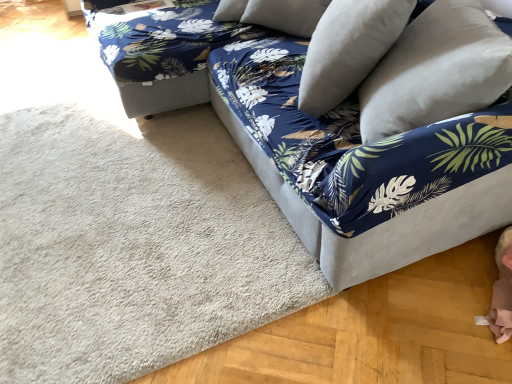
Measure the distance between velvet blue couch at center and camera.

The distance of velvet blue couch at center from camera is 1.08 meters.

What do you see at coordinates (436, 71) in the screenshot?
I see `velvety white pillow at upper right, which ranks as the second pillow in left-to-right order` at bounding box center [436, 71].

You are a GUI agent. You are given a task and a screenshot of the screen. Output one action in this format:
    pyautogui.click(x=<x>, y=<y>)
    Task: Click on the beige carpet at lower left
    This screenshot has height=384, width=512.
    Given the screenshot: What is the action you would take?
    pyautogui.click(x=134, y=246)

Could you measure the distance between beige carpet at lower left and velvety white pillow at upper right, which ranks as the second pillow in left-to-right order?

beige carpet at lower left is 36.79 inches away from velvety white pillow at upper right, which ranks as the second pillow in left-to-right order.

From a real-world perspective, between beige carpet at lower left and velvety white pillow at upper right, the first pillow viewed from the right, who is vertically higher?

In real-world perspective, velvety white pillow at upper right, the first pillow viewed from the right, is above.

Based on their sizes in the image, would you say beige carpet at lower left is bigger or smaller than velvety white pillow at upper right, which ranks as the second pillow in left-to-right order?

beige carpet at lower left is smaller than velvety white pillow at upper right, which ranks as the second pillow in left-to-right order.

Which of these two, beige carpet at lower left or velvety white pillow at upper right, the first pillow viewed from the right, stands shorter?

beige carpet at lower left is shorter.

Starting from the blue floral fabric bean bag at upper right, which pillow is the 2nd one in front? Please provide its 2D coordinates.

[(436, 71)]

Does point (480, 76) appear closer or farther from the camera than point (187, 66)?

Point (480, 76) is closer to the camera than point (187, 66).

How far apart are velvety white pillow at upper right, which ranks as the second pillow in left-to-right order, and blue floral fabric bean bag at upper right?

A distance of 4.11 feet exists between velvety white pillow at upper right, which ranks as the second pillow in left-to-right order, and blue floral fabric bean bag at upper right.

Is velvety white pillow at upper right, the first pillow viewed from the right, aimed at blue floral fabric bean bag at upper right?

No, velvety white pillow at upper right, the first pillow viewed from the right, is not turned towards blue floral fabric bean bag at upper right.

Is beige carpet at lower left to the left or to the right of white soft pillow at upper right, the second pillow positioned from the right, in the image?

In the image, beige carpet at lower left appears on the left side of white soft pillow at upper right, the second pillow positioned from the right.

Is point (63, 291) closer to viewer compared to point (368, 47)?

No, (63, 291) is further to viewer.

From the image's perspective, is white soft pillow at upper right, the second pillow positioned from the right, above or below velvety white pillow at upper right, the first pillow viewed from the right?

Clearly, from the image's perspective, white soft pillow at upper right, the second pillow positioned from the right, is above velvety white pillow at upper right, the first pillow viewed from the right.

Where is `pillow located in front of the white soft pillow at upper right, the second pillow positioned from the right`? pillow located in front of the white soft pillow at upper right, the second pillow positioned from the right is located at coordinates (436, 71).

Is there a large distance between white soft pillow at upper right, marked as the 1th pillow in a left-to-right arrangement, and velvety white pillow at upper right, which ranks as the second pillow in left-to-right order?

white soft pillow at upper right, marked as the 1th pillow in a left-to-right arrangement, is actually quite close to velvety white pillow at upper right, which ranks as the second pillow in left-to-right order.

Is white soft pillow at upper right, marked as the 1th pillow in a left-to-right arrangement, to the left or to the right of velvety white pillow at upper right, which ranks as the second pillow in left-to-right order, in the image?

Based on their positions, white soft pillow at upper right, marked as the 1th pillow in a left-to-right arrangement, is located to the left of velvety white pillow at upper right, which ranks as the second pillow in left-to-right order.

Is blue floral fabric bean bag at upper right facing towards velvety white pillow at upper right, the first pillow viewed from the right?

Yes.

Is blue floral fabric bean bag at upper right in contact with velvety white pillow at upper right, which ranks as the second pillow in left-to-right order?

blue floral fabric bean bag at upper right is not next to velvety white pillow at upper right, which ranks as the second pillow in left-to-right order, and they're not touching.

Looking at this image, which of these two, blue floral fabric bean bag at upper right or velvety white pillow at upper right, the first pillow viewed from the right, stands taller?

blue floral fabric bean bag at upper right is taller.

Can you confirm if blue floral fabric bean bag at upper right is smaller than velvety white pillow at upper right, which ranks as the second pillow in left-to-right order?

No, blue floral fabric bean bag at upper right is not smaller than velvety white pillow at upper right, which ranks as the second pillow in left-to-right order.

Based on the photo, from the image's perspective, relative to velvet blue couch at center, is beige carpet at lower left above or below?

Clearly, from the image's perspective, beige carpet at lower left is below velvet blue couch at center.

Can you confirm if beige carpet at lower left is smaller than velvet blue couch at center?

Indeed, beige carpet at lower left has a smaller size compared to velvet blue couch at center.

Does beige carpet at lower left touch velvet blue couch at center?

No, beige carpet at lower left is not in contact with velvet blue couch at center.

The height and width of the screenshot is (384, 512). I want to click on studio couch above the beige carpet at lower left (from the image's perspective), so click(348, 162).

From the image's perspective, is velvet blue couch at center above or below velvety white pillow at upper right, the first pillow viewed from the right?

velvet blue couch at center is situated higher than velvety white pillow at upper right, the first pillow viewed from the right, in the image.

Considering the sizes of objects velvet blue couch at center and velvety white pillow at upper right, the first pillow viewed from the right, in the image provided, who is smaller, velvet blue couch at center or velvety white pillow at upper right, the first pillow viewed from the right,?

velvety white pillow at upper right, the first pillow viewed from the right, is smaller.

Which is in front, velvet blue couch at center or velvety white pillow at upper right, which ranks as the second pillow in left-to-right order?

velvet blue couch at center is more forward.

Is velvet blue couch at center wider or thinner than velvety white pillow at upper right, the first pillow viewed from the right?

velvet blue couch at center is wider than velvety white pillow at upper right, the first pillow viewed from the right.

The image size is (512, 384). What are the coordinates of `mat on the left side of velvety white pillow at upper right, the first pillow viewed from the right` in the screenshot? It's located at (134, 246).

There is a blue floral fabric bean bag at upper right. Where is `the 2nd pillow above it (from a real-world perspective)`? The width and height of the screenshot is (512, 384). the 2nd pillow above it (from a real-world perspective) is located at coordinates (436, 71).

From the image, which object appears to be nearer to beige carpet at lower left, blue floral fabric bean bag at upper right or velvet blue couch at center?

velvet blue couch at center lies closer to beige carpet at lower left than the other object.

Which object lies nearer to the anchor point blue floral fabric bean bag at upper right, velvety white pillow at upper right, the first pillow viewed from the right, or beige carpet at lower left?

beige carpet at lower left.

Based on their spatial positions, is velvet blue couch at center or velvety white pillow at upper right, the first pillow viewed from the right, closer to white soft pillow at upper right, the second pillow positioned from the right?

velvety white pillow at upper right, the first pillow viewed from the right, is positioned closer to the anchor white soft pillow at upper right, the second pillow positioned from the right.

Which object lies further to the anchor point white soft pillow at upper right, the second pillow positioned from the right, velvet blue couch at center or blue floral fabric bean bag at upper right?

blue floral fabric bean bag at upper right.

When comparing their distances from velvety white pillow at upper right, which ranks as the second pillow in left-to-right order, does beige carpet at lower left or blue floral fabric bean bag at upper right seem further?

The object further to velvety white pillow at upper right, which ranks as the second pillow in left-to-right order, is blue floral fabric bean bag at upper right.

Based on their spatial positions, is blue floral fabric bean bag at upper right or velvety white pillow at upper right, which ranks as the second pillow in left-to-right order, further from velvet blue couch at center?

Based on the image, blue floral fabric bean bag at upper right appears to be further to velvet blue couch at center.

Based on their spatial positions, is white soft pillow at upper right, marked as the 1th pillow in a left-to-right arrangement, or blue floral fabric bean bag at upper right closer to velvet blue couch at center?

white soft pillow at upper right, marked as the 1th pillow in a left-to-right arrangement, is closer to velvet blue couch at center.

Which object lies nearer to the anchor point velvet blue couch at center, beige carpet at lower left or blue floral fabric bean bag at upper right?

The object closer to velvet blue couch at center is blue floral fabric bean bag at upper right.

The image size is (512, 384). What are the coordinates of `pillow situated between beige carpet at lower left and velvet blue couch at center from left to right` in the screenshot? It's located at (348, 49).

Find the location of a particular element. The height and width of the screenshot is (384, 512). bean bag chair between beige carpet at lower left and velvety white pillow at upper right, which ranks as the second pillow in left-to-right order is located at coordinates (159, 50).

What are the coordinates of `pillow between beige carpet at lower left and velvety white pillow at upper right, the first pillow viewed from the right` in the screenshot? It's located at (348, 49).

Locate an element on the screen. bean bag chair between beige carpet at lower left and velvet blue couch at center in the horizontal direction is located at coordinates (159, 50).